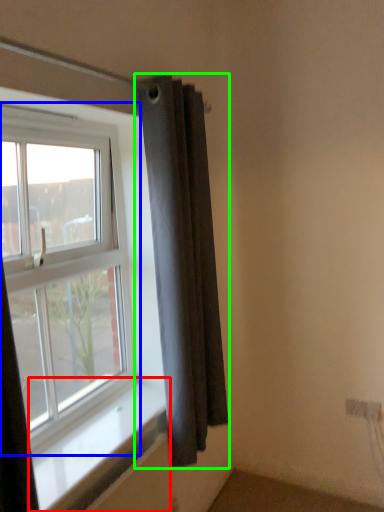
Question: Based on their relative distances, which object is farther from window sill (highlighted by a red box)? Choose from window (highlighted by a blue box) and curtain (highlighted by a green box).

Choices:
 (A) window
 (B) curtain

Answer: (B)